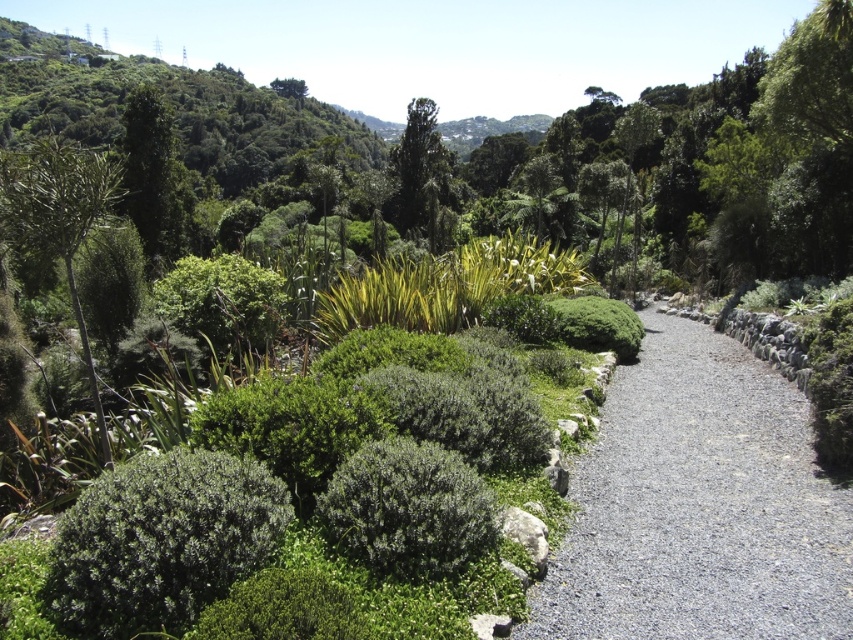
Is gray gravel path at center smaller than green leafy tree at center?

Indeed, gray gravel path at center has a smaller size compared to green leafy tree at center.

What do you see at coordinates (699, 506) in the screenshot?
I see `gray gravel path at center` at bounding box center [699, 506].

At what (x,y) coordinates should I click in order to perform the action: click on gray gravel path at center. Please return your answer as a coordinate pair (x, y). The height and width of the screenshot is (640, 853). Looking at the image, I should click on (699, 506).